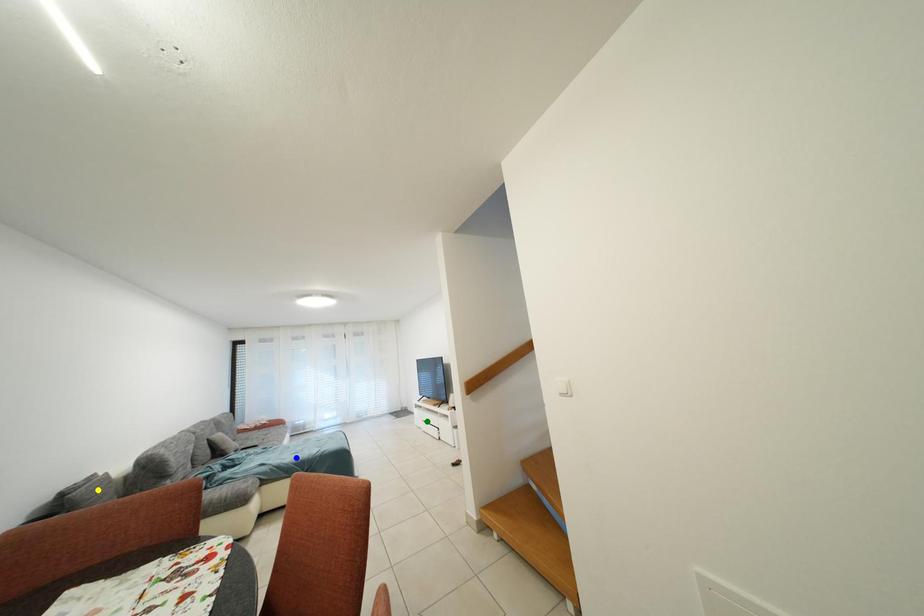
Order these from nearest to farthest:
A) green point
B) yellow point
C) blue point

1. yellow point
2. blue point
3. green point